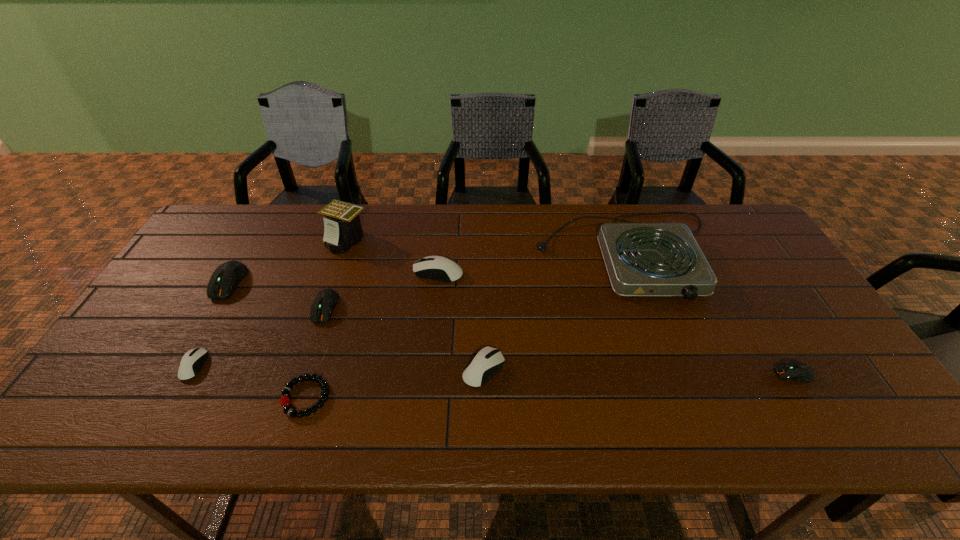
Identify the location of the rightmost computer equipment. (798, 371).

The width and height of the screenshot is (960, 540). In order to click on the nearest dark computer equipment in this screenshot , I will do point(798,371).

Find the location of a particular element. Image resolution: width=960 pixels, height=540 pixels. the shortest object is located at coordinates (285, 400).

The image size is (960, 540). Identify the location of bracelet. (285, 400).

Find the location of a particular element. free space located 0.090m on the right of the tallest object is located at coordinates (397, 240).

You are a GUI agent. You are given a task and a screenshot of the screen. Output one action in this format:
    pyautogui.click(x=<x>, y=<y>)
    Task: Click on the free spot located 0.370m with a retractable cable on the side of the hotplate
    The width and height of the screenshot is (960, 540).
    Given the screenshot: What is the action you would take?
    693,433

Find the location of a particular element. This screenshot has width=960, height=540. vacant point located 0.380m on the front of the biggest white mouse is located at coordinates (425, 401).

Locate an element on the screen. The image size is (960, 540). free location located 0.150m on the button of the biggest dark computer equipment is located at coordinates (193, 345).

This screenshot has height=540, width=960. What are the coordinates of `vacant space positioned 0.140m on the left of the second biggest white mouse` in the screenshot? It's located at (405, 369).

Where is `free space located 0.220m on the button of the second dark computer equipment from right to left`? This screenshot has height=540, width=960. free space located 0.220m on the button of the second dark computer equipment from right to left is located at coordinates (295, 399).